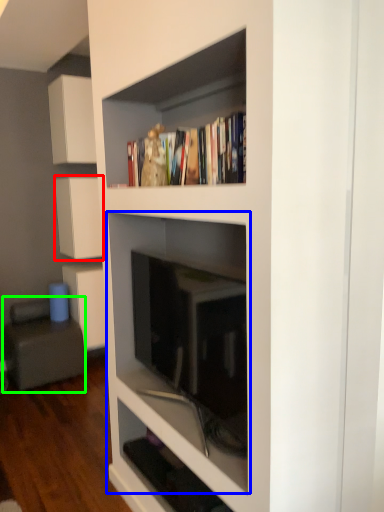
Question: Based on their relative distances, which object is nearer to cabinetry (highlighted by a red box)? Choose from shelf (highlighted by a blue box) and armchair (highlighted by a green box).

Choices:
 (A) shelf
 (B) armchair

Answer: (B)